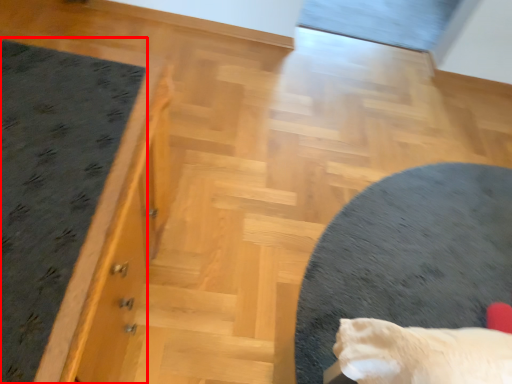
Question: From the image's perspective, what is the correct spatial positioning of mat (annotated by the red box) in reference to furniture?

Choices:
 (A) above
 (B) below

Answer: (A)